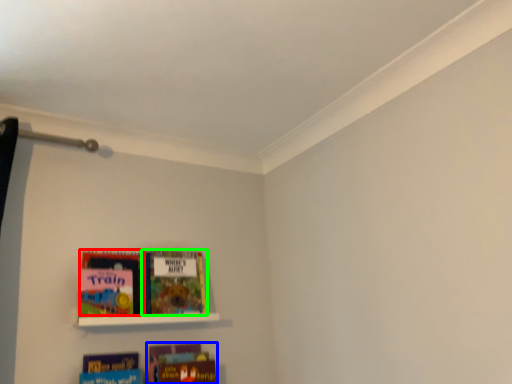
Question: Which is nearer to the book (highlighted by a red box)? book (highlighted by a blue box) or book (highlighted by a green box).

Choices:
 (A) book
 (B) book

Answer: (B)